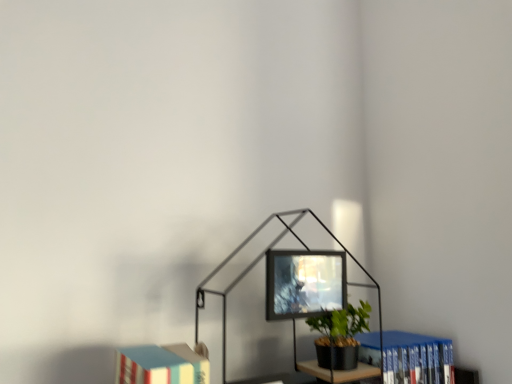
Question: Looking at their shapes, would you say metallic black table lamp at center is wider or thinner than hardcover book at lower left, which is the first book in front-to-back order?

Choices:
 (A) wide
 (B) thin

Answer: (A)

Question: Is point (312, 216) positioned closer to the camera than point (186, 374)?

Choices:
 (A) farther
 (B) closer

Answer: (A)

Question: Based on their relative distances, which object is nearer to the matte black monitor at center?

Choices:
 (A) blue hardcover book at lower right, the first book viewed from the back
 (B) metallic black table lamp at center
 (C) hardcover book at lower left, which appears as the second book when viewed from the back

Answer: (B)

Question: Considering the real-world distances, which object is farthest from the hardcover book at lower left, which appears as the second book when viewed from the back?

Choices:
 (A) matte black monitor at center
 (B) blue hardcover book at lower right, the 1th book from the right
 (C) metallic black table lamp at center

Answer: (B)